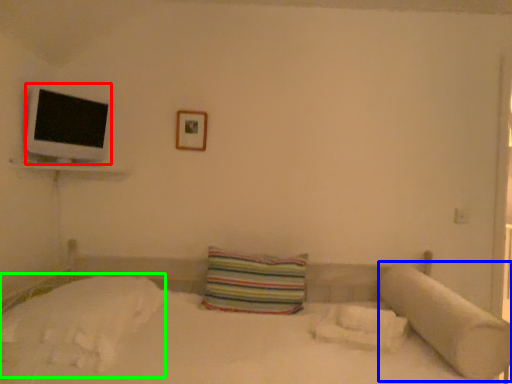
Question: Considering the real-world distances, which object is farthest from flat (highlighted by a red box)? pillow (highlighted by a blue box) or sheet (highlighted by a green box)?

Choices:
 (A) pillow
 (B) sheet

Answer: (A)